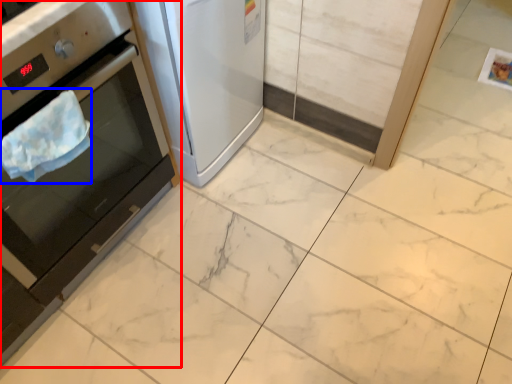
Question: Among these objects, which one is nearest to the camera, home appliance (highlighted by a red box) or blanket (highlighted by a blue box)?

Choices:
 (A) home appliance
 (B) blanket

Answer: (A)